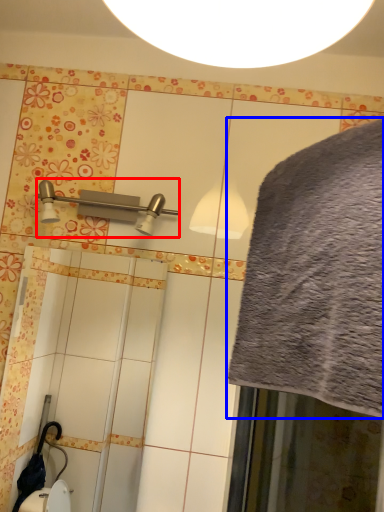
Question: Among these objects, which one is farthest to the camera, shower (highlighted by a red box) or bath towel (highlighted by a blue box)?

Choices:
 (A) shower
 (B) bath towel

Answer: (A)